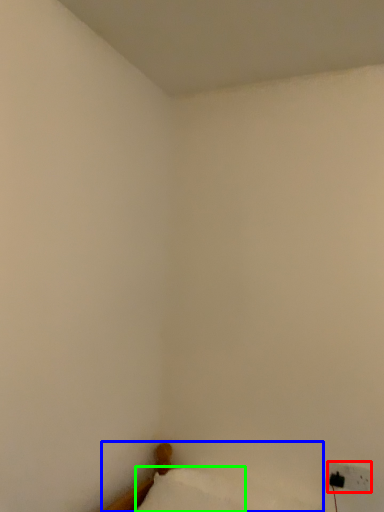
Question: Which object is the farthest from electric outlet (highlighted by a red box)? Choose among these: furniture (highlighted by a blue box) or pillow (highlighted by a green box).

Choices:
 (A) furniture
 (B) pillow

Answer: (B)